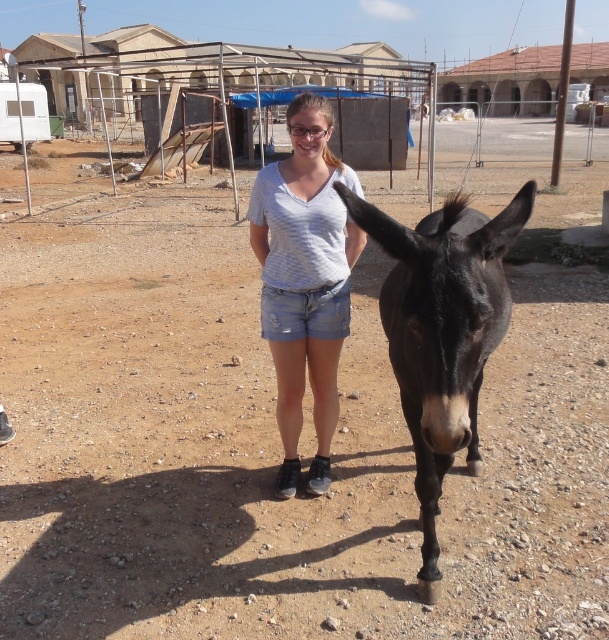
You are a photographer trying to capture a closeup of the clear plastic goggles at center without including the white striped shirt at center in the frame. Given their relative sizes, is this possible?

The white striped shirt at center is wider than the clear plastic goggles at center, so it might be challenging to frame the goggles without including the shirt if they are both positioned at the center. Adjust the camera angle or zoom in to focus solely on the goggles.

You are a photographer trying to capture a closeup of the black glossy mule at center and the white striped shirt at center in the scene. Can you fit both subjects into your camera frame if your camera has a minimum focus distance of 24 inches?

The black glossy mule at center and white striped shirt at center are 26.12 inches apart from each other. Since the minimum focus distance is 24 inches, the camera can focus on both subjects as they are within the required distance.